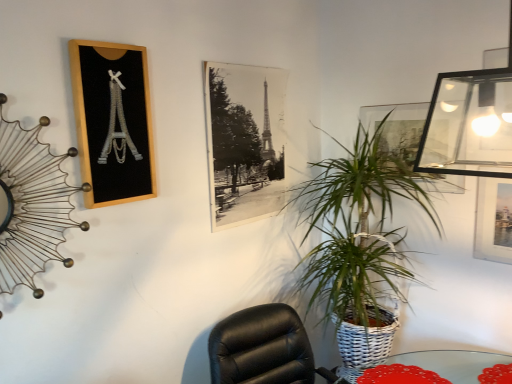
Question: Can you confirm if black paper at center, the 2th picture frame positioned from the right, is bigger than transparent glass picture frame at upper right, the first picture frame positioned from the right?

Choices:
 (A) yes
 (B) no

Answer: (A)

Question: Is black paper at center, the 2th picture frame positioned from the right, taller than transparent glass picture frame at upper right, placed as the 3th picture frame when sorted from left to right?

Choices:
 (A) yes
 (B) no

Answer: (A)

Question: Can you confirm if black paper at center, the 2th picture frame positioned from the right, is positioned to the left of transparent glass picture frame at upper right, the first picture frame positioned from the right?

Choices:
 (A) no
 (B) yes

Answer: (B)

Question: Can you confirm if black paper at center, the 2th picture frame positioned from the right, is shorter than transparent glass picture frame at upper right, the first picture frame positioned from the right?

Choices:
 (A) yes
 (B) no

Answer: (B)

Question: From the image's perspective, does black paper at center, which appears as the second picture frame when viewed from the left, appear higher than transparent glass picture frame at upper right, placed as the 3th picture frame when sorted from left to right?

Choices:
 (A) no
 (B) yes

Answer: (A)

Question: Is black paper at center, which appears as the second picture frame when viewed from the left, touching transparent glass picture frame at upper right, the first picture frame positioned from the right?

Choices:
 (A) no
 (B) yes

Answer: (A)

Question: Is green woven basket at center-right closer to the viewer compared to wooden picture frame at upper left, the 3th picture frame from the right?

Choices:
 (A) no
 (B) yes

Answer: (A)

Question: Is wooden picture frame at upper left, acting as the first picture frame starting from the left, a part of green woven basket at center-right?

Choices:
 (A) no
 (B) yes

Answer: (A)

Question: Are green woven basket at center-right and wooden picture frame at upper left, acting as the first picture frame starting from the left, beside each other?

Choices:
 (A) yes
 (B) no

Answer: (B)

Question: From the image's perspective, is green woven basket at center-right under wooden picture frame at upper left, acting as the first picture frame starting from the left?

Choices:
 (A) yes
 (B) no

Answer: (A)

Question: Is green woven basket at center-right at the right side of wooden picture frame at upper left, the 3th picture frame from the right?

Choices:
 (A) yes
 (B) no

Answer: (A)

Question: Is wooden picture frame at upper left, the 3th picture frame from the right, at the back of green woven basket at center-right?

Choices:
 (A) no
 (B) yes

Answer: (A)

Question: From a real-world perspective, is gold wire clock at upper left located beneath transparent glass picture frame at upper right, placed as the 3th picture frame when sorted from left to right?

Choices:
 (A) yes
 (B) no

Answer: (A)